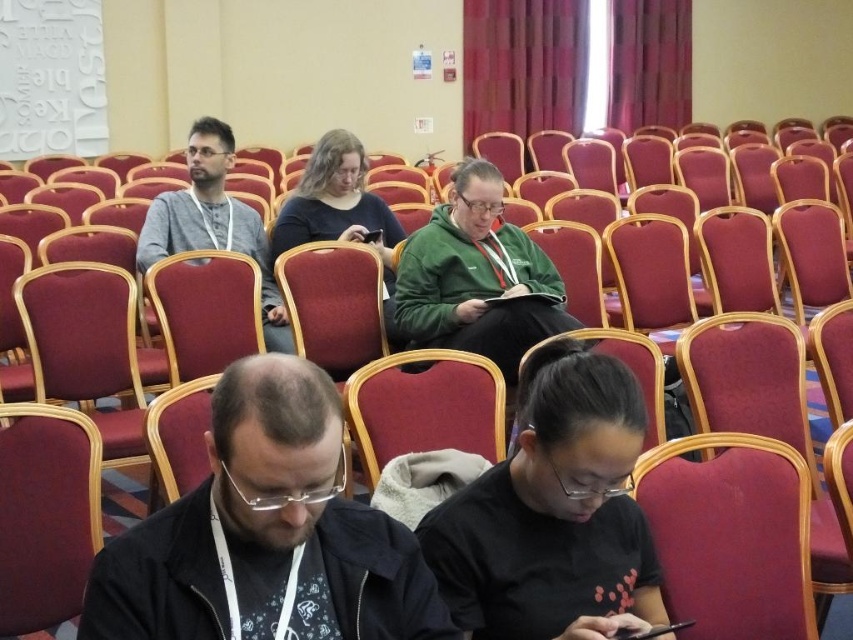
Question: Based on their relative distances, which object is nearer to the black matte jacket at lower center?

Choices:
 (A) black matte shirt at lower center
 (B) gray knit sweater at left

Answer: (A)

Question: Considering the relative positions of black matte jacket at lower center and gray knit sweater at left in the image provided, where is black matte jacket at lower center located with respect to gray knit sweater at left?

Choices:
 (A) below
 (B) above

Answer: (A)

Question: Which of the following is the farthest from the observer?

Choices:
 (A) (485, 627)
 (B) (190, 570)
 (C) (225, 208)

Answer: (C)

Question: Which of the following is the closest to the observer?

Choices:
 (A) (213, 168)
 (B) (637, 552)
 (C) (260, 396)

Answer: (C)

Question: Is black matte jacket at lower center below gray knit sweater at left?

Choices:
 (A) yes
 (B) no

Answer: (A)

Question: Can you confirm if black matte jacket at lower center is positioned above gray knit sweater at left?

Choices:
 (A) no
 (B) yes

Answer: (A)